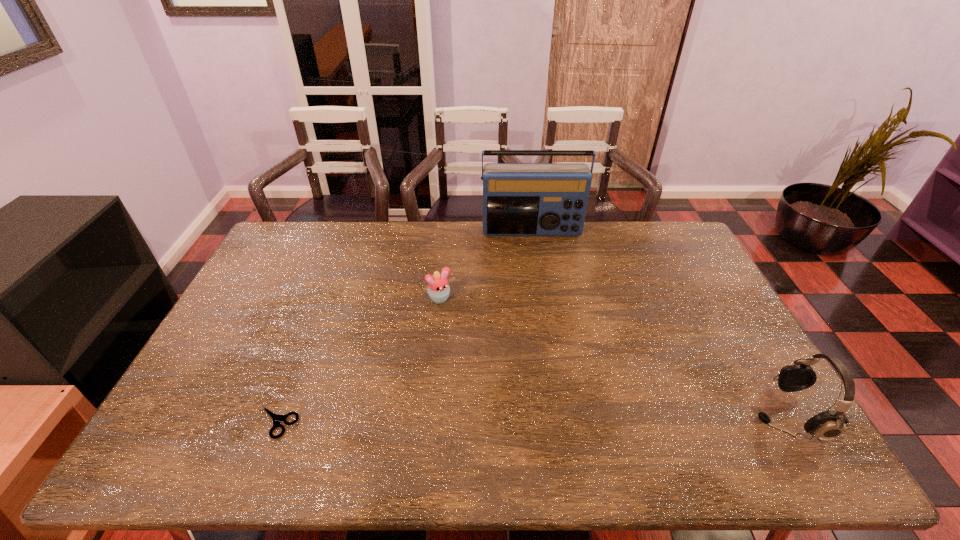
Identify the location of headset positioned at the near edge. (828, 425).

You are a GUI agent. You are given a task and a screenshot of the screen. Output one action in this format:
    pyautogui.click(x=<x>, y=<y>)
    Task: Click on the object that is at the right edge
    Image resolution: width=960 pixels, height=540 pixels.
    Given the screenshot: What is the action you would take?
    pyautogui.click(x=828, y=425)

This screenshot has height=540, width=960. I want to click on object that is at the near right corner, so click(828, 425).

This screenshot has height=540, width=960. Identify the location of vacant space at the far edge. (443, 224).

Image resolution: width=960 pixels, height=540 pixels. Identify the location of vacant space at the near edge. (251, 395).

This screenshot has width=960, height=540. In the image, there is a desktop. Find the location of `vacant space at the left edge`. vacant space at the left edge is located at coordinates (265, 281).

You are a GUI agent. You are given a task and a screenshot of the screen. Output one action in this format:
    pyautogui.click(x=<x>, y=<y>)
    Task: Click on the free region at the right edge
    The height and width of the screenshot is (540, 960).
    Given the screenshot: What is the action you would take?
    (680, 292)

Locate an element on the screen. vacant space at the far left corner is located at coordinates (285, 251).

At what (x,y) coordinates should I click in order to perform the action: click on free space at the far right corner of the desktop. Please return your answer as a coordinate pair (x, y). This screenshot has height=540, width=960. Looking at the image, I should click on (646, 234).

Locate an element on the screen. Image resolution: width=960 pixels, height=540 pixels. free space that is in between the shortest object and the rightmost object is located at coordinates (531, 418).